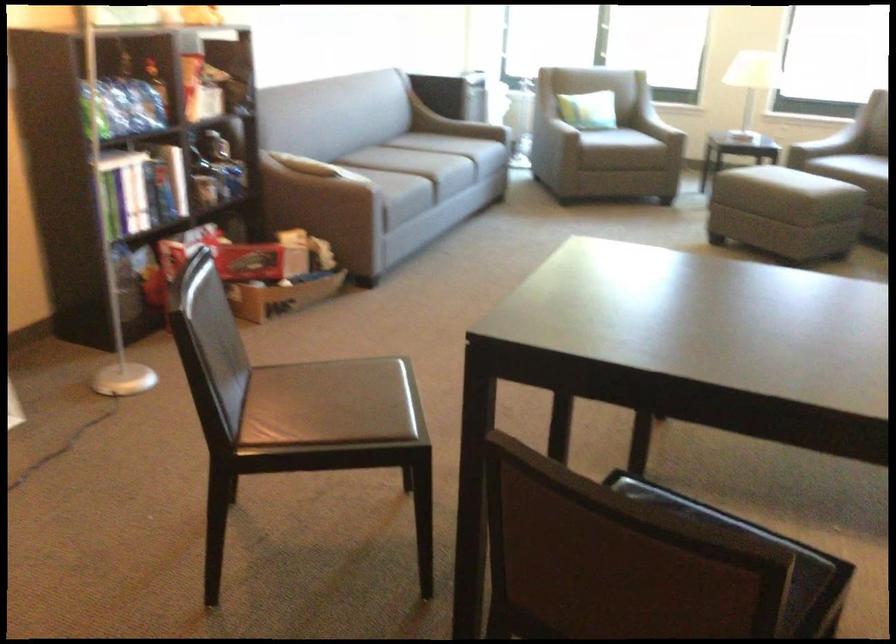
The image size is (896, 644). What do you see at coordinates (451, 124) in the screenshot?
I see `the sofa armrest` at bounding box center [451, 124].